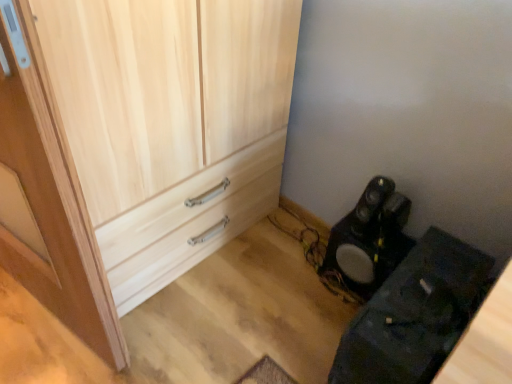
Question: Can you confirm if wooden door at left is thinner than black matte speaker at lower right?

Choices:
 (A) yes
 (B) no

Answer: (A)

Question: Does wooden door at left have a greater height compared to black matte speaker at lower right?

Choices:
 (A) no
 (B) yes

Answer: (B)

Question: From a real-world perspective, is wooden door at left on top of black matte speaker at lower right?

Choices:
 (A) no
 (B) yes

Answer: (B)

Question: Considering the relative sizes of wooden door at left and black matte speaker at lower right in the image provided, is wooden door at left bigger than black matte speaker at lower right?

Choices:
 (A) no
 (B) yes

Answer: (B)

Question: From a real-world perspective, is wooden door at left physically below black matte speaker at lower right?

Choices:
 (A) no
 (B) yes

Answer: (A)

Question: Is black matte speaker at lower right inside or outside of black matte speaker at lower right?

Choices:
 (A) outside
 (B) inside

Answer: (A)

Question: Based on their sizes in the image, would you say black matte speaker at lower right is bigger or smaller than black matte speaker at lower right?

Choices:
 (A) big
 (B) small

Answer: (B)

Question: From a real-world perspective, is black matte speaker at lower right physically located above or below black matte speaker at lower right?

Choices:
 (A) below
 (B) above

Answer: (A)

Question: Is point (359, 289) closer or farther from the camera than point (418, 306)?

Choices:
 (A) closer
 (B) farther

Answer: (B)

Question: Based on their sizes in the image, would you say natural wood cupboard at center is bigger or smaller than black matte speaker at lower right?

Choices:
 (A) small
 (B) big

Answer: (B)

Question: Considering the positions of natural wood cupboard at center and black matte speaker at lower right in the image, is natural wood cupboard at center wider or thinner than black matte speaker at lower right?

Choices:
 (A) wide
 (B) thin

Answer: (A)

Question: Which is correct: natural wood cupboard at center is inside black matte speaker at lower right, or outside of it?

Choices:
 (A) outside
 (B) inside

Answer: (A)

Question: Is natural wood cupboard at center taller or shorter than black matte speaker at lower right?

Choices:
 (A) short
 (B) tall

Answer: (B)

Question: In the image, is wooden door at left positioned in front of or behind natural wood cupboard at center?

Choices:
 (A) behind
 (B) front

Answer: (B)

Question: In terms of width, does wooden door at left look wider or thinner when compared to natural wood cupboard at center?

Choices:
 (A) thin
 (B) wide

Answer: (A)